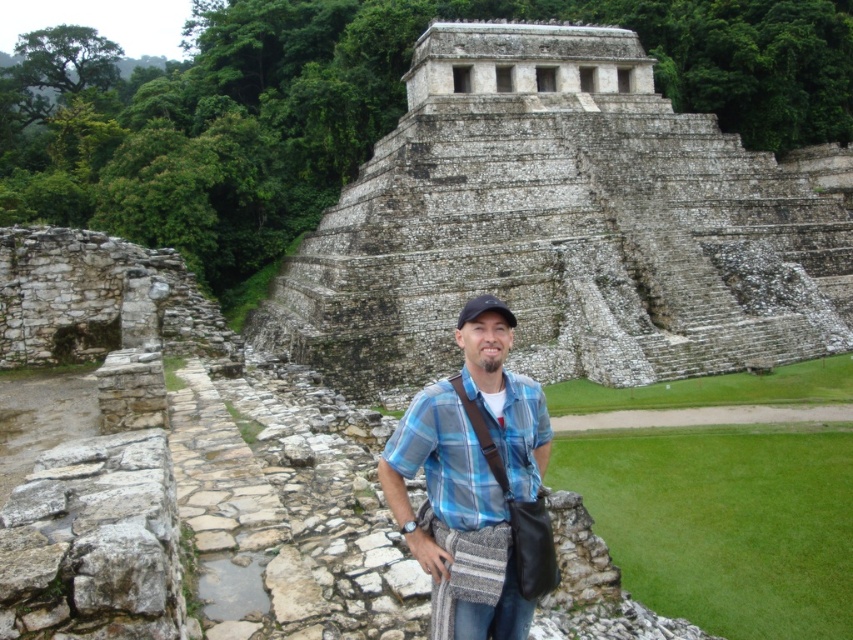
Question: Does stone textured pyramid at center have a lesser width compared to blue plaid shirt at center?

Choices:
 (A) yes
 (B) no

Answer: (B)

Question: Which object appears closest to the camera in this image?

Choices:
 (A) stone textured pyramid at center
 (B) blue plaid shirt at center

Answer: (B)

Question: Is stone textured pyramid at center smaller than blue plaid shirt at center?

Choices:
 (A) no
 (B) yes

Answer: (A)

Question: Is stone textured pyramid at center further to camera compared to blue plaid shirt at center?

Choices:
 (A) yes
 (B) no

Answer: (A)

Question: Which of the following is the closest to the observer?

Choices:
 (A) (593, 326)
 (B) (480, 365)

Answer: (B)